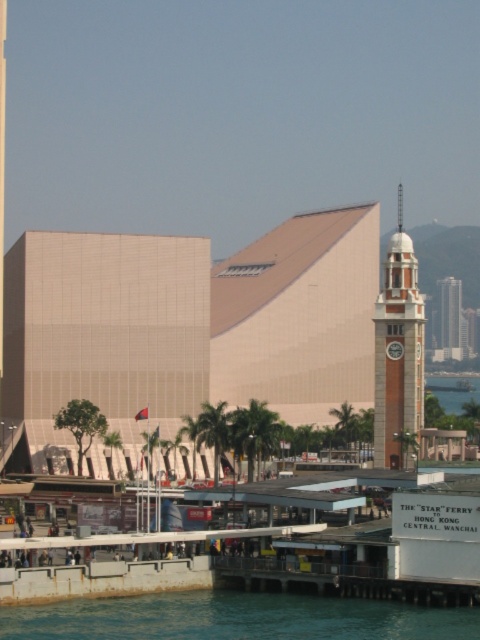
Looking at this image, you are a tourist standing on the pier and want to take a photo of the red brick clock tower at center and the clear blue water at lower left. Based on their positions, which object should you frame first in your camera viewfinder to ensure both are in the shot?

The clear blue water at lower left is to the left of the red brick clock tower at center, so you should frame the clear blue water at lower left first to ensure both are captured in the photo.

You are standing at the point marked by the coordinates point at (397, 352). Based on the scene description, which object are you currently on?

The point at (397, 352) is located on the red brick clock tower at center.